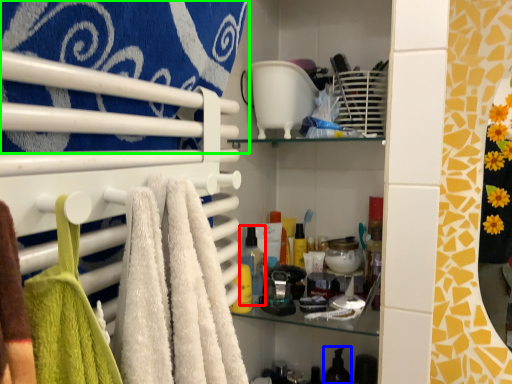
Question: Based on their relative distances, which object is farther from toiletry (highlighted by a red box)? Choose from toiletry (highlighted by a blue box) and towel (highlighted by a green box).

Choices:
 (A) toiletry
 (B) towel

Answer: (B)